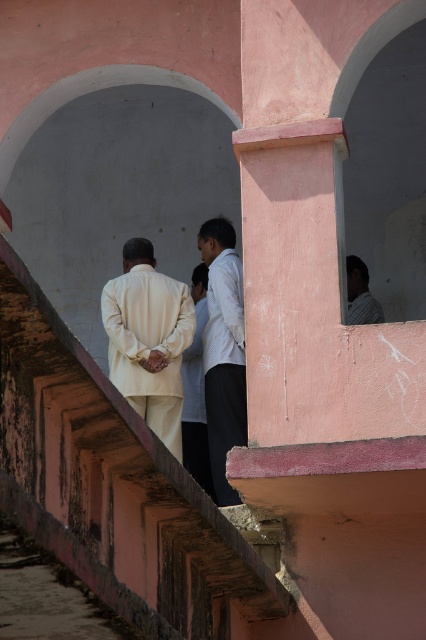
You are a fashion designer observing two outfits in the image set in a historical South Asian structure with pink walls and arched doorways. The outfits are the matte cream suit at center and the light beige fabric robe at center. Which outfit is bigger in size?

The matte cream suit at center is larger in size compared to the light beige fabric robe at center according to the description.

You are a tour guide leading a group through this historical site. You notice two visitors, one wearing a light beige fabric robe at center and another in a light brown shirt at upper right. If you want to ensure both visitors can hear your explanation clearly, how far apart are they from each other?

The distance between the light beige fabric robe at center and the light brown shirt at upper right is 9.28 meters. Since this distance is relatively large, you may need to use a microphone or move closer to each group to ensure clarity.